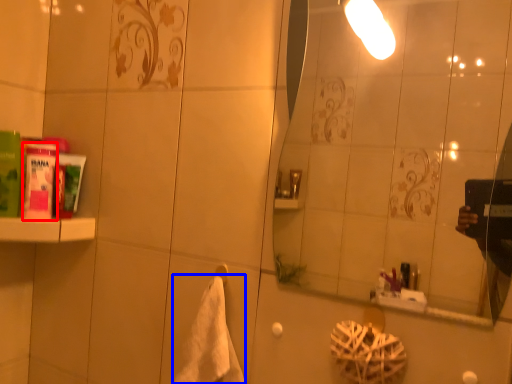
Question: Which object is further to the camera taking this photo, mouthwash (highlighted by a red box) or bath towel (highlighted by a blue box)?

Choices:
 (A) mouthwash
 (B) bath towel

Answer: (A)